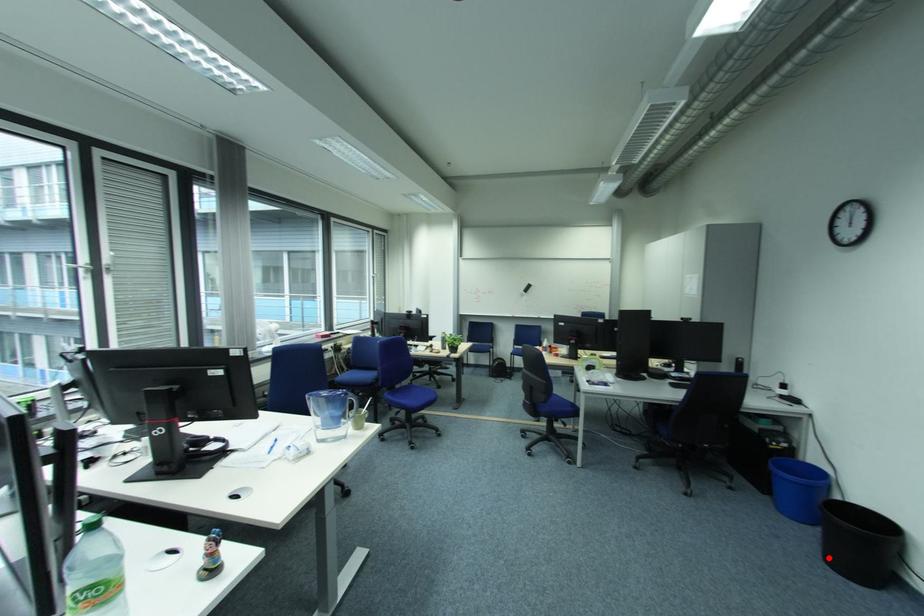
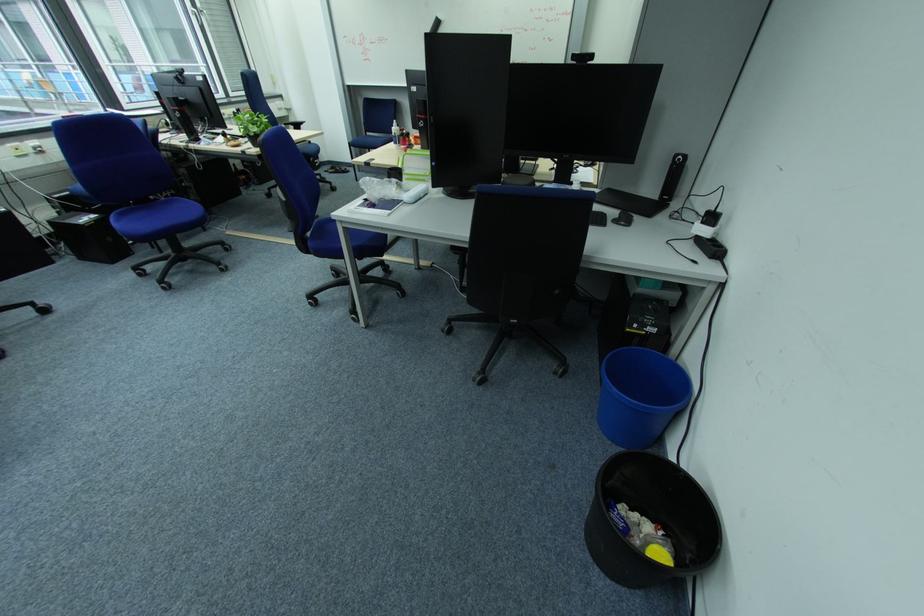
Question: I am providing you with two images of the same scene from different viewpoints. Image1 has a red point marked. In image2, the corresponding 3D location appears at what relative position? Reply with the corresponding letter.

Choices:
 (A) Closer
 (B) Farther

Answer: (B)